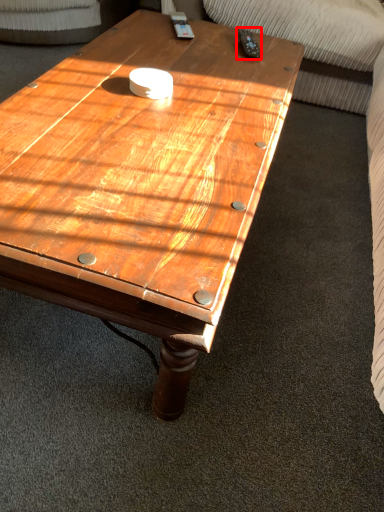
Question: Considering the relative positions of remote (annotated by the red box) and coffee table in the image provided, where is remote (annotated by the red box) located with respect to the staircase?

Choices:
 (A) right
 (B) left

Answer: (A)